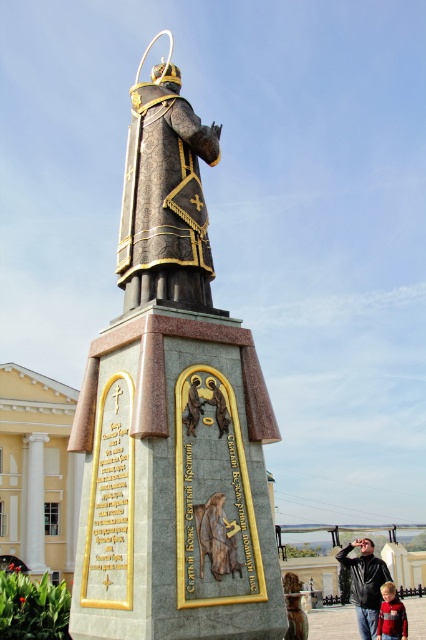
Question: Observing the image, what is the correct spatial positioning of gold textured statue at center in reference to goldmetallicstatue at center?

Choices:
 (A) left
 (B) right

Answer: (A)

Question: Where is gold-bronze statue at center located in relation to black leather jacket at lower right in the image?

Choices:
 (A) left
 (B) right

Answer: (A)

Question: Which is nearer to the red sweater at lower right?

Choices:
 (A) gold-bronze statue at center
 (B) gold textured statue at center

Answer: (B)

Question: Which point is closer to the camera?

Choices:
 (A) (144, 166)
 (B) (192, 408)
 (C) (187, 337)

Answer: (B)

Question: In this image, where is brown leather belt at lower center located relative to gold textured statue at center?

Choices:
 (A) below
 (B) above

Answer: (A)

Question: Which object appears farthest from the camera in this image?

Choices:
 (A) black leather jacket at lower right
 (B) polished bronze statue at center

Answer: (A)